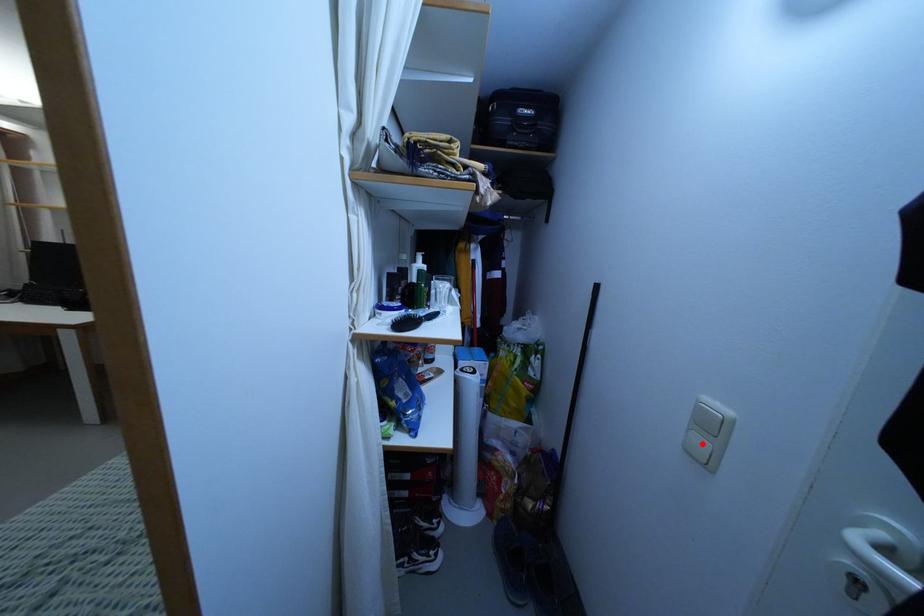
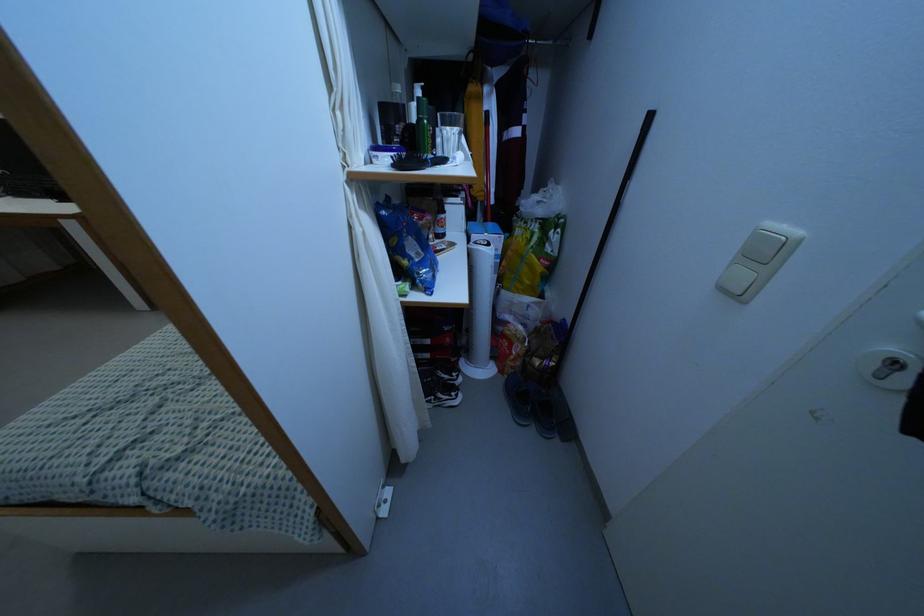
Where in the second image is the point corresponding to the highlighted location from the first image?

(743, 276)